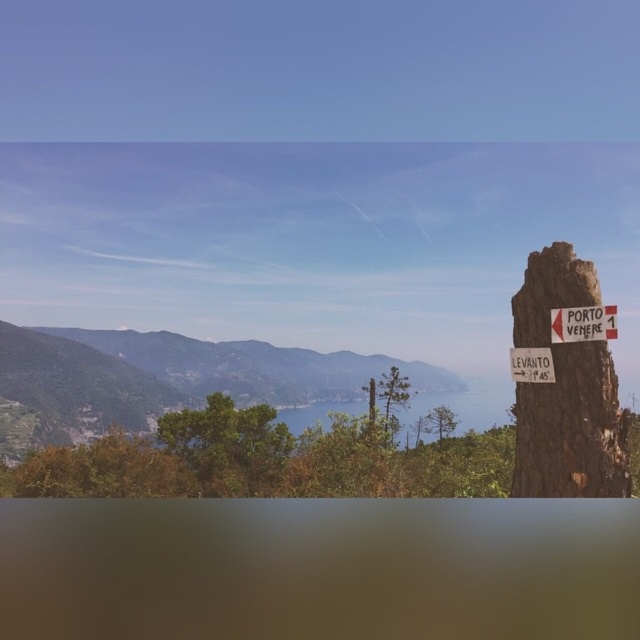
Which is above, green leafy mountain at left or brown wooden signpost at right?

Positioned higher is brown wooden signpost at right.

Can you confirm if green leafy mountain at left is taller than brown wooden signpost at right?

Indeed, green leafy mountain at left has a greater height compared to brown wooden signpost at right.

Measure the distance between green leafy mountain at left and camera.

green leafy mountain at left and camera are 29.60 meters apart from each other.

Identify the location of green leafy mountain at left. This screenshot has height=640, width=640. (163, 380).

From the picture: Is green leafy mountain at left closer to camera compared to white plastic sign at right?

No, it is not.

Who is more distant from viewer, (449, 378) or (568, 337)?

The point (449, 378) is behind.

Which is behind, point (294, 392) or point (564, 337)?

The point (294, 392) is more distant.

This screenshot has height=640, width=640. I want to click on green leafy mountain at left, so click(x=163, y=380).

Who is higher up, green leafy tree at center or brown wooden signpost at right?

brown wooden signpost at right is higher up.

Which is in front, point (195, 483) or point (538, 368)?

Point (538, 368) is more forward.

The height and width of the screenshot is (640, 640). I want to click on green leafy tree at center, so click(227, 444).